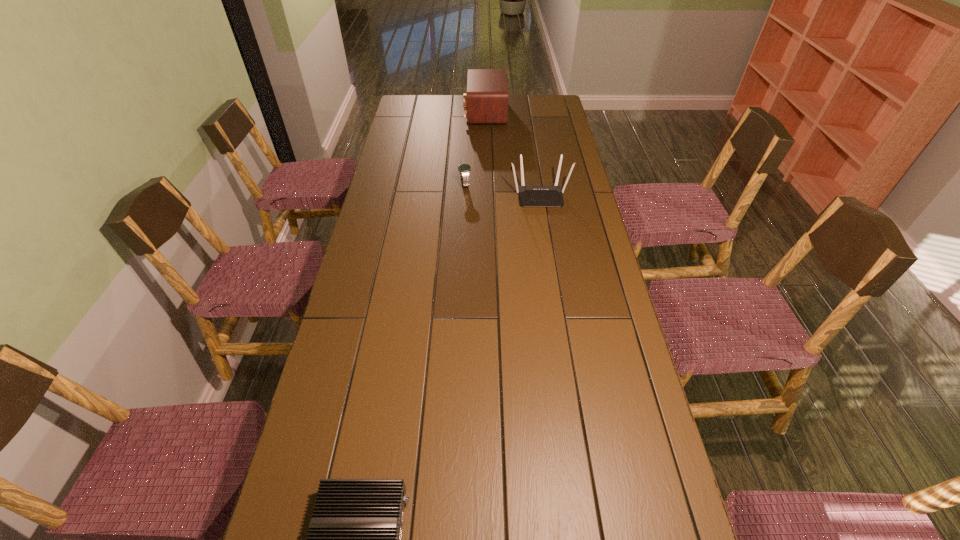
This screenshot has height=540, width=960. I want to click on radio receiver, so click(x=486, y=101).

Image resolution: width=960 pixels, height=540 pixels. What are the coordinates of `the farther router` in the screenshot? It's located at (530, 196).

You are a GUI agent. You are given a task and a screenshot of the screen. Output one action in this format:
    pyautogui.click(x=<x>, y=<y>)
    Task: Click on the taller router
    The image size is (960, 540).
    Given the screenshot: What is the action you would take?
    pyautogui.click(x=530, y=196)

You are a GUI agent. You are given a task and a screenshot of the screen. Output one action in this format:
    pyautogui.click(x=<x>, y=<y>)
    Task: Click on the watch
    
    Given the screenshot: What is the action you would take?
    pyautogui.click(x=464, y=169)

This screenshot has height=540, width=960. In order to click on vacant space located on the front panel of the farthest object in this screenshot , I will do `click(410, 113)`.

The width and height of the screenshot is (960, 540). I want to click on free space located 0.130m on the front panel of the farthest object, so click(439, 113).

This screenshot has width=960, height=540. Identify the location of free location located on the front panel of the farthest object. (421, 113).

Find the location of a particular element. This screenshot has width=960, height=540. vacant space located on the front-facing side of the right router is located at coordinates (544, 221).

You are a GUI agent. You are given a task and a screenshot of the screen. Output one action in this format:
    pyautogui.click(x=<x>, y=<y>)
    Task: Click on the vacant region located on the back of the watch
    
    Given the screenshot: What is the action you would take?
    pyautogui.click(x=466, y=164)

Identify the location of object located in the far edge section of the desktop. (486, 101).